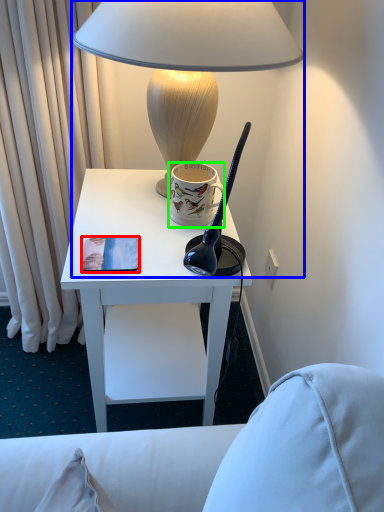
Question: Based on their relative distances, which object is nearer to pad (highlighted by a red box)? Choose from lamp (highlighted by a blue box) and coffee cup (highlighted by a green box).

Choices:
 (A) lamp
 (B) coffee cup

Answer: (B)